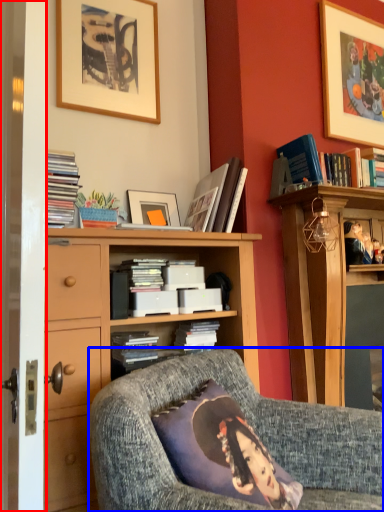
Question: Which object is closer to the camera taking this photo, screen door (highlighted by a red box) or chair (highlighted by a blue box)?

Choices:
 (A) screen door
 (B) chair

Answer: (B)